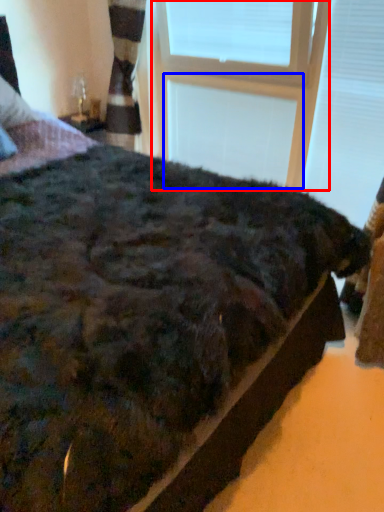
Question: Which of the following is the farthest to the observer, window frame (highlighted by a red box) or window frame (highlighted by a blue box)?

Choices:
 (A) window frame
 (B) window frame

Answer: (B)